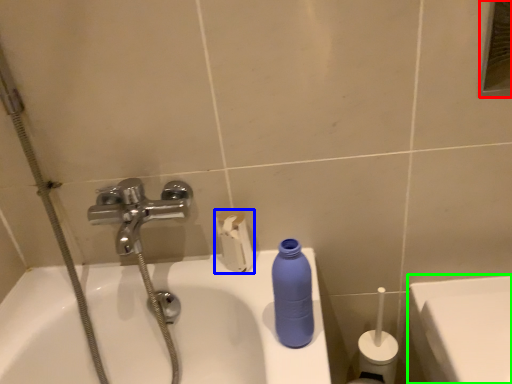
Question: Considering the real-world distances, which object is farthest from mirror (highlighted by a red box)? toilet paper (highlighted by a blue box) or porcelain (highlighted by a green box)?

Choices:
 (A) toilet paper
 (B) porcelain

Answer: (A)